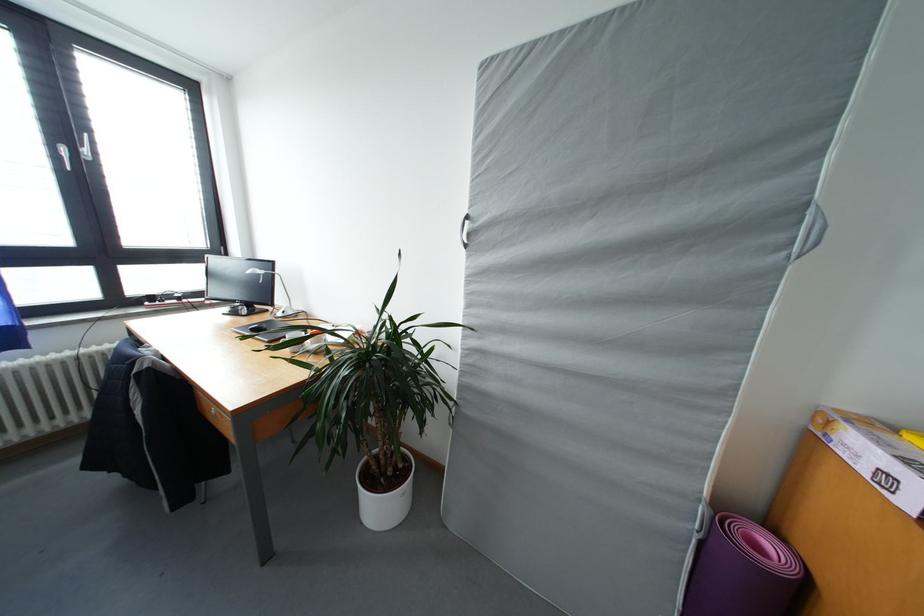
Where would you click the computer mouse? Please return your answer as a coordinate pair (x, y).

(257, 328)